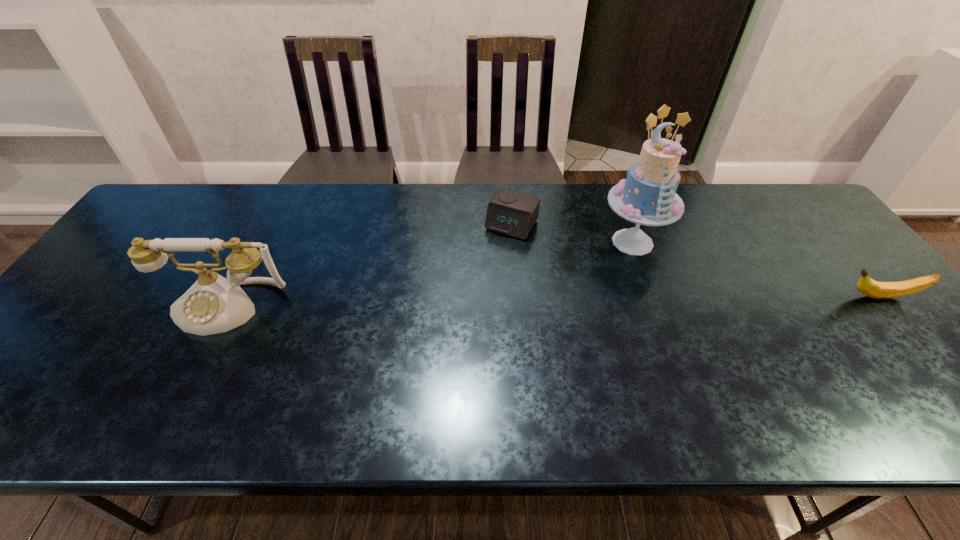
You are a GUI agent. You are given a task and a screenshot of the screen. Output one action in this format:
    pyautogui.click(x=<x>, y=<y>)
    Task: Click on the third shortest object
    
    Given the screenshot: What is the action you would take?
    pyautogui.click(x=213, y=304)

Find the location of a particular element. The image size is (960, 540). telephone is located at coordinates (213, 304).

Find the location of `the rightmost object`. the rightmost object is located at coordinates (878, 290).

Locate an element on the screen. the second object from right to left is located at coordinates (647, 196).

Image resolution: width=960 pixels, height=540 pixels. Find the location of `cake`. cake is located at coordinates (647, 196).

You are a GUI agent. You are given a task and a screenshot of the screen. Output one action in this format:
    pyautogui.click(x=<x>, y=<y>)
    Task: Click on the alarm clock
    
    Given the screenshot: What is the action you would take?
    pyautogui.click(x=511, y=213)

Where is `blank space located on the dial of the leftmost object`? The width and height of the screenshot is (960, 540). blank space located on the dial of the leftmost object is located at coordinates (196, 365).

You are a GUI agent. You are given a task and a screenshot of the screen. Output one action in this format:
    pyautogui.click(x=<x>, y=<y>)
    Task: Click on the vacant space located 0.130m at the stem of the rightmost object
    The width and height of the screenshot is (960, 540).
    Given the screenshot: What is the action you would take?
    pyautogui.click(x=790, y=297)

You are a GUI agent. You are given a task and a screenshot of the screen. Output one action in this format:
    pyautogui.click(x=<x>, y=<y>)
    Task: Click on the vacant position located at the stem of the rightmost object
    
    Given the screenshot: What is the action you would take?
    pyautogui.click(x=734, y=297)

Image resolution: width=960 pixels, height=540 pixels. I want to click on free space located at the stem of the rightmost object, so click(704, 297).